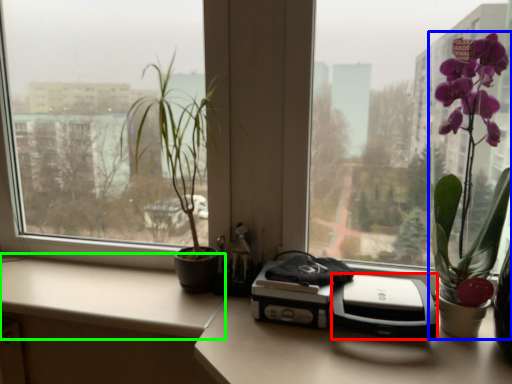
Question: Which is nearer to the printer (highlighted by a red box)? houseplant (highlighted by a blue box) or counter top (highlighted by a green box).

Choices:
 (A) houseplant
 (B) counter top

Answer: (A)